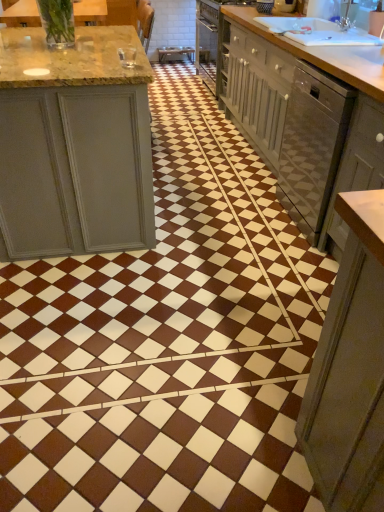
The width and height of the screenshot is (384, 512). In order to click on vacant region to the left of white glossy dishwasher at right in this screenshot , I will do `click(249, 211)`.